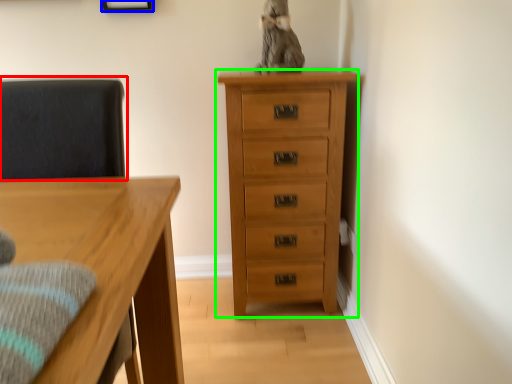
Question: Which object is positioned farthest from swivel chair (highlighted by a red box)? Select from picture frame (highlighted by a blue box) and chest of drawers (highlighted by a green box).

Choices:
 (A) picture frame
 (B) chest of drawers

Answer: (A)